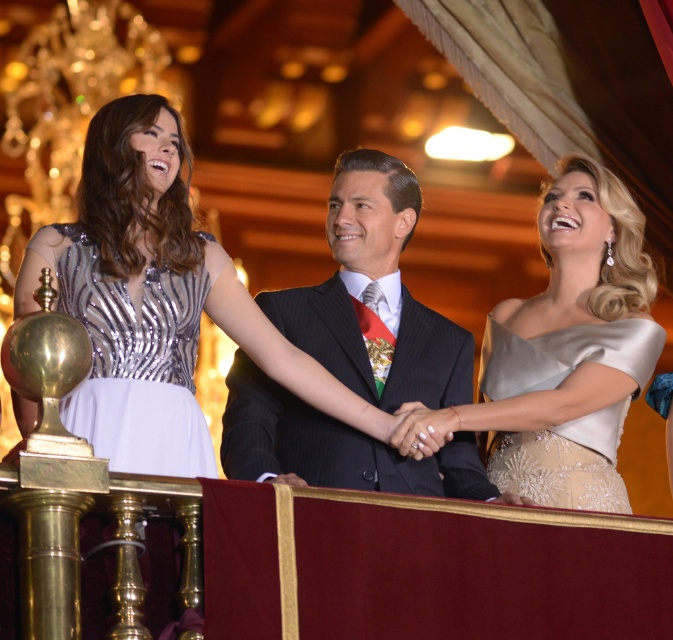
Question: Is dark pinstripe suit at center wider than satin beige dress at right?

Choices:
 (A) no
 (B) yes

Answer: (A)

Question: Which is farther from the dark pinstripe suit at center?

Choices:
 (A) satin beige dress at upper right
 (B) satin beige dress at right
 (C) shiny silver dress at center

Answer: (B)

Question: Is shiny silver dress at center above satin beige dress at upper right?

Choices:
 (A) no
 (B) yes

Answer: (B)

Question: Where is shiny silver dress at center located in relation to satin beige dress at upper right in the image?

Choices:
 (A) right
 (B) left

Answer: (B)

Question: Which object is closer to the camera taking this photo?

Choices:
 (A) dark pinstripe suit at center
 (B) shiny silver dress at center
 (C) silver sequined dress at left
 (D) satin beige dress at upper right

Answer: (C)

Question: Which point is farther to the camera?

Choices:
 (A) silver sequined dress at left
 (B) shiny silver dress at center
 (C) satin beige dress at right

Answer: (C)